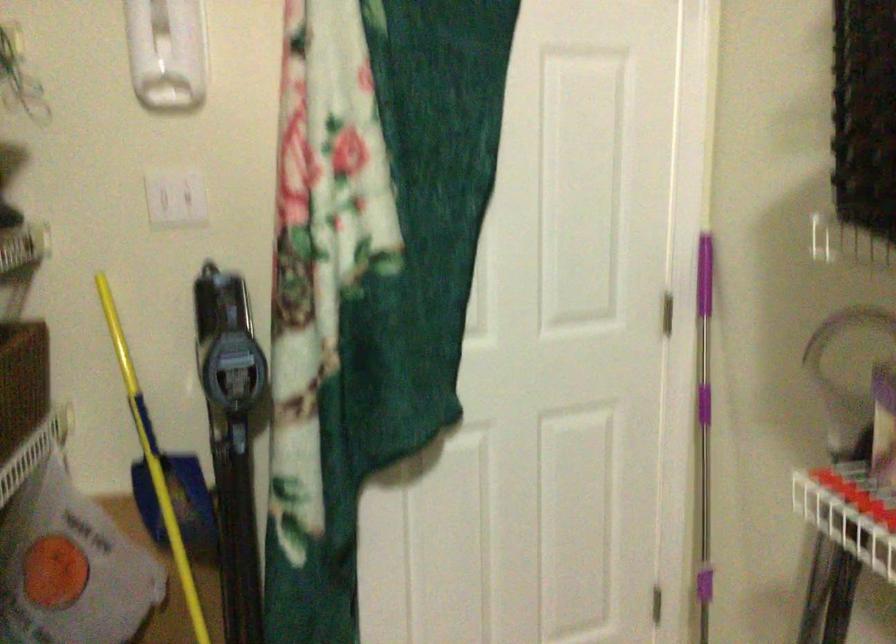
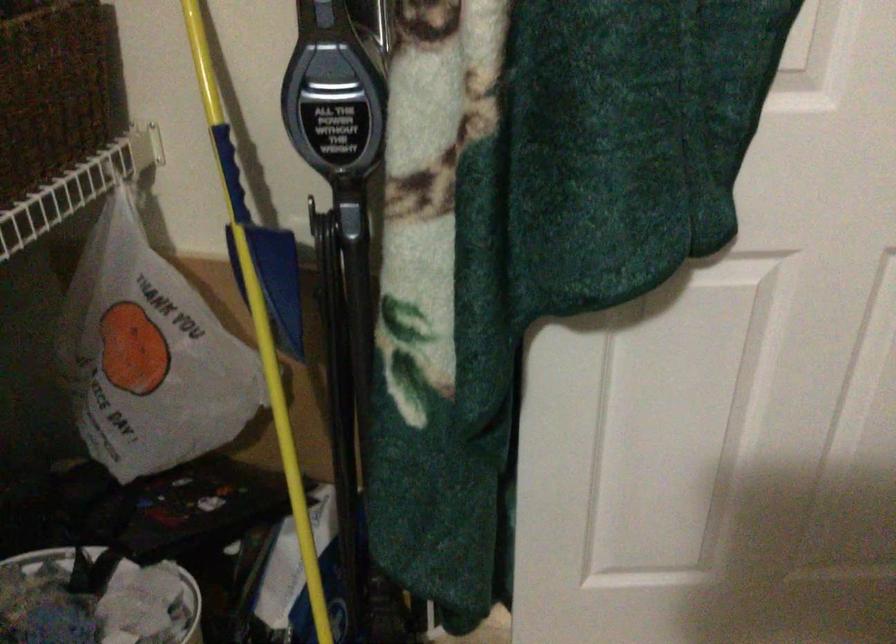
Where in the second image is the point corresponding to point (134, 343) from the first image?

(213, 44)